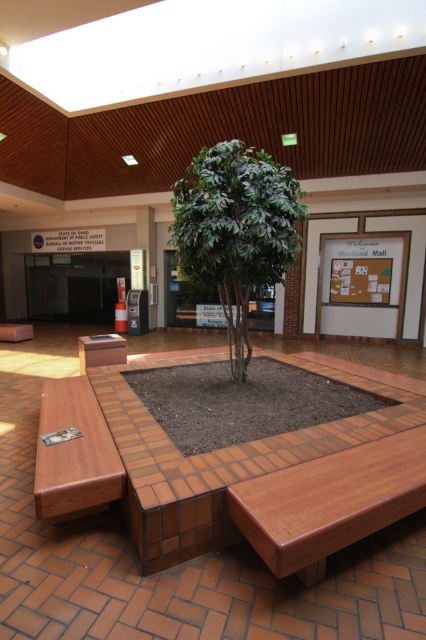
Measure the distance from green leafy tree at center to brown wood bench at lower left.

green leafy tree at center and brown wood bench at lower left are 7.16 meters apart.

Between green leafy tree at center and brown wood bench at lower left, which one is positioned lower?

brown wood bench at lower left

Identify the location of green leafy tree at center. Image resolution: width=426 pixels, height=640 pixels. (236, 230).

The image size is (426, 640). What do you see at coordinates (74, 452) in the screenshot?
I see `wooden bench at lower left` at bounding box center [74, 452].

Can you confirm if wooden bench at lower left is positioned below brown wood bench at lower left?

Indeed, wooden bench at lower left is positioned under brown wood bench at lower left.

Does point (66, 396) lie in front of point (23, 332)?

Yes.

Identify the location of wooden bench at lower left. The height and width of the screenshot is (640, 426). (74, 452).

Is wooden bench at center positioned before wooden bench at lower left?

Yes, wooden bench at center is in front of wooden bench at lower left.

Which is more to the left, wooden bench at center or wooden bench at lower left?

From the viewer's perspective, wooden bench at lower left appears more on the left side.

Which is behind, point (394, 512) or point (74, 420)?

Point (74, 420)

Locate an element on the screen. The image size is (426, 640). wooden bench at center is located at coordinates (330, 500).